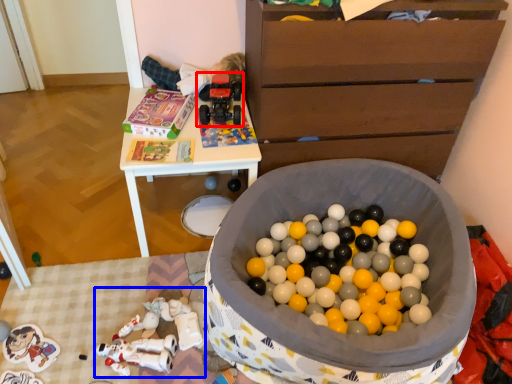
Question: Which object is closer to the camera taking this photo, toy (highlighted by a red box) or toy (highlighted by a blue box)?

Choices:
 (A) toy
 (B) toy

Answer: (B)